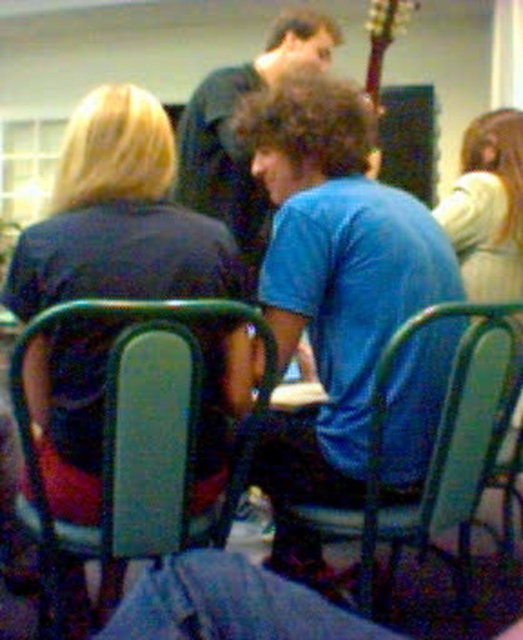
Question: Is blue cotton shirt at center to the right of metallic green chair at center from the viewer's perspective?

Choices:
 (A) no
 (B) yes

Answer: (A)

Question: Among these points, which one is nearest to the camera?

Choices:
 (A) (396, 556)
 (B) (399, 28)
 (C) (299, 22)
 (D) (349, 378)

Answer: (D)

Question: Can you confirm if green plastic chair at center is smaller than metallic green chair at center?

Choices:
 (A) yes
 (B) no

Answer: (A)

Question: Considering the real-world distances, which object is farthest from the blue cotton shirt at center?

Choices:
 (A) metallic green chair at center
 (B) dark blue shirt at center
 (C) wooden acoustic guitar at upper right

Answer: (C)

Question: Estimate the real-world distances between objects in this image. Which object is closer to the blue cotton shirt at center?

Choices:
 (A) wooden acoustic guitar at upper right
 (B) metallic green chair at center
 (C) green plastic chair at center

Answer: (B)

Question: Does blue cotton shirt at center have a smaller size compared to metallic green chair at center?

Choices:
 (A) no
 (B) yes

Answer: (B)